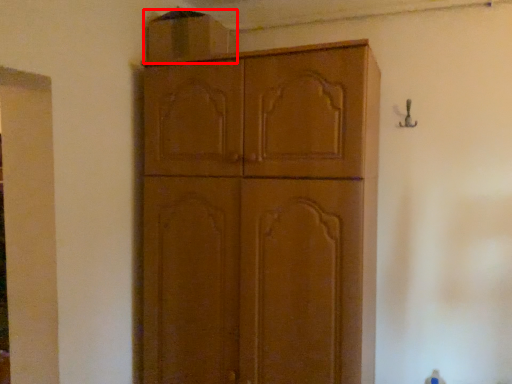
Question: From the image's perspective, considering the relative positions of cabinetry (annotated by the red box) and cabinetry in the image provided, where is cabinetry (annotated by the red box) located with respect to the staircase?

Choices:
 (A) below
 (B) above

Answer: (B)